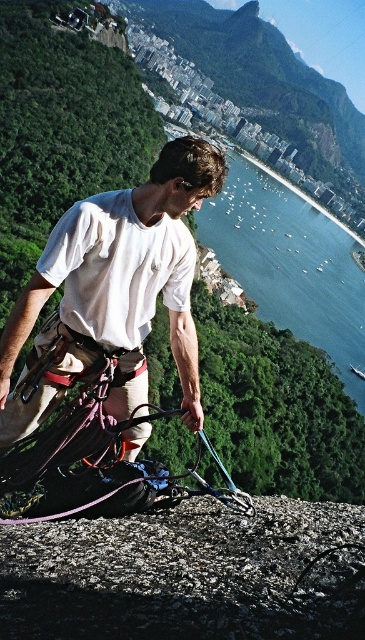
Which of these two, smooth gray rock at center or blue water at center, stands taller?

Standing taller between the two is blue water at center.

Who is more forward, (x=117, y=529) or (x=304, y=289)?

Positioned in front is point (x=117, y=529).

In order to click on smooth gray rock at center in this screenshot , I will do `click(187, 573)`.